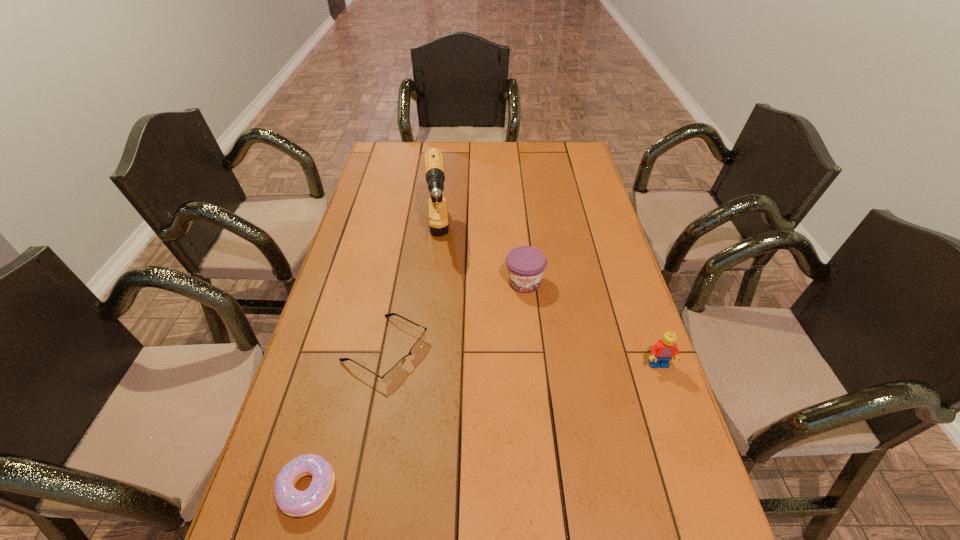
You are a GUI agent. You are given a task and a screenshot of the screen. Output one action in this format:
    pyautogui.click(x=<x>, y=<y>)
    Task: Click on the free space on the desktop that is between the nearest object and the Lego and is positioned at the tip of the drill
    The height and width of the screenshot is (540, 960).
    Given the screenshot: What is the action you would take?
    [450, 438]

At what (x,y) coordinates should I click in order to perform the action: click on vacant space on the desktop that is between the doughnut and the Lego and is positioned on the front label of the third tallest object. Please return your answer as a coordinate pair (x, y). This screenshot has height=540, width=960. Looking at the image, I should click on (549, 404).

Where is `free spot on the desktop that is between the nearest object and the rightmost object and is positioned on the front-facing side of the spectacles`? The width and height of the screenshot is (960, 540). free spot on the desktop that is between the nearest object and the rightmost object and is positioned on the front-facing side of the spectacles is located at coordinates (508, 418).